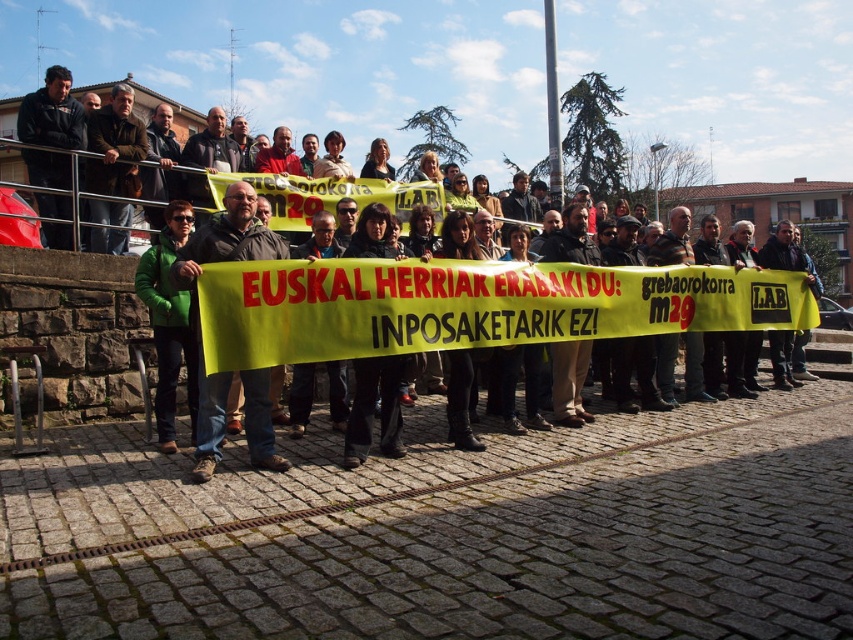
Question: Can you confirm if green fabric banner at center is positioned to the right of dark brown leather jacket at center?

Choices:
 (A) no
 (B) yes

Answer: (A)

Question: Does green fabric banner at center lie in front of dark brown leather jacket at center?

Choices:
 (A) no
 (B) yes

Answer: (A)

Question: Does green fabric banner at center come in front of dark brown leather jacket at center?

Choices:
 (A) yes
 (B) no

Answer: (B)

Question: Which of the following is the closest to the observer?

Choices:
 (A) (126, 342)
 (B) (241, 225)

Answer: (B)

Question: Which of the following is the farthest from the observer?

Choices:
 (A) (248, 444)
 (B) (77, 257)

Answer: (B)